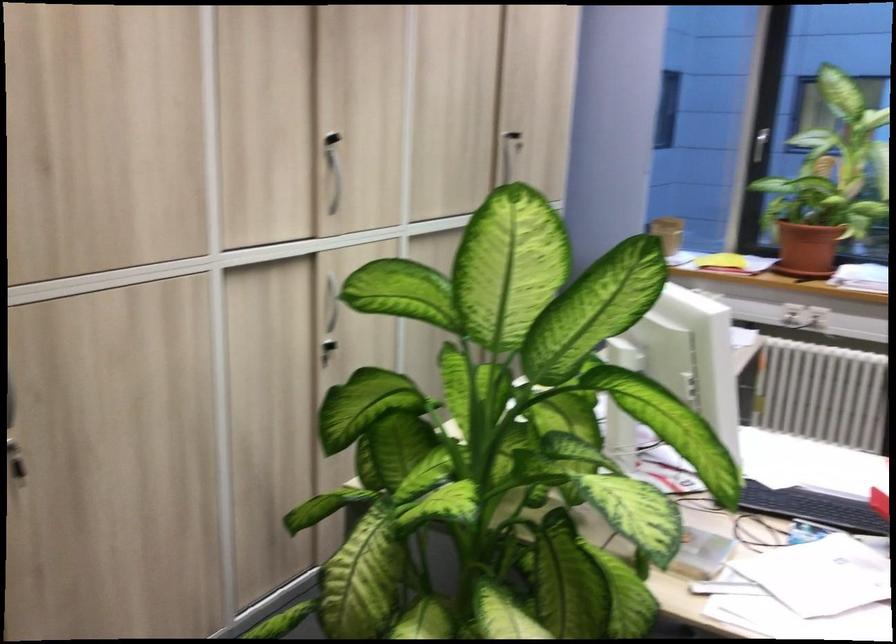
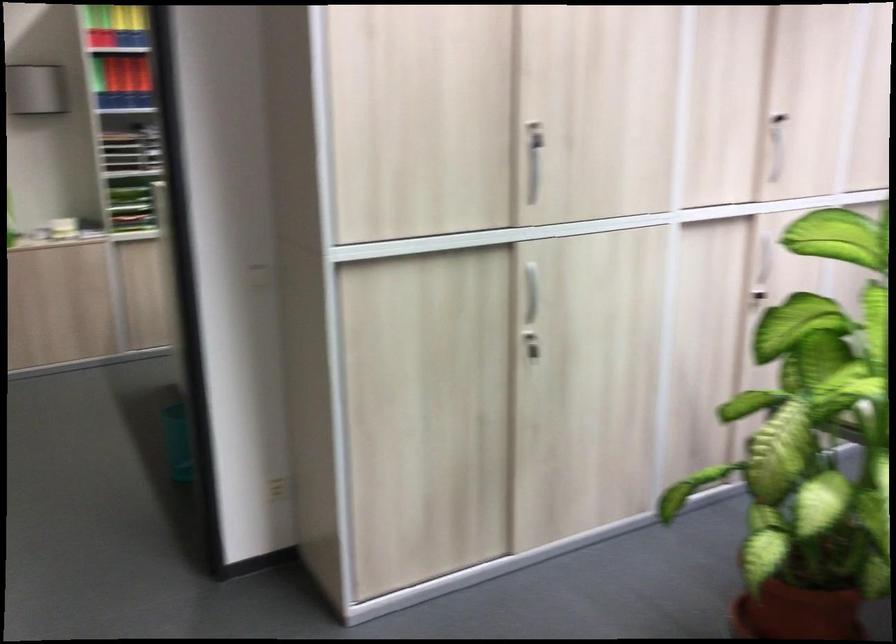
Locate, in the second image, the point that corresponds to (337,131) in the first image.

(779, 116)